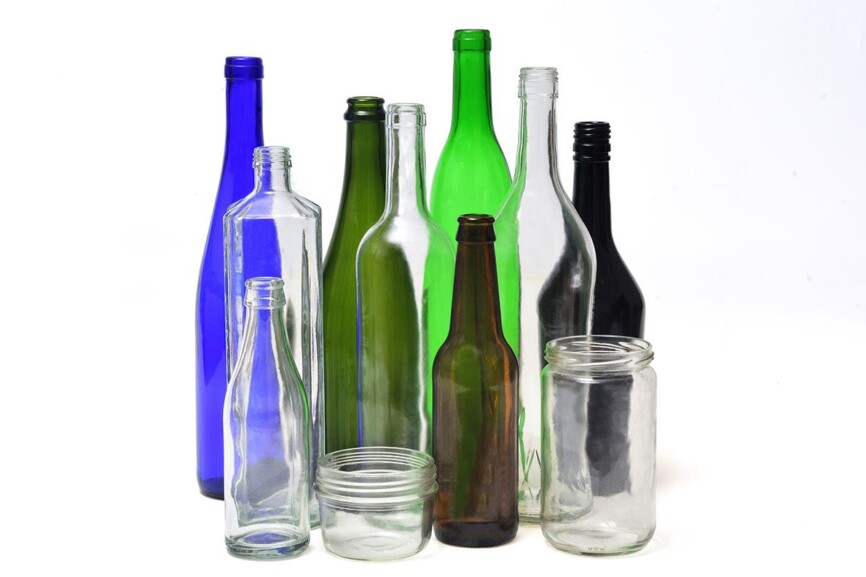
What are the coordinates of `5 tallest bottles` in the screenshot? It's located at [537, 77], [469, 48], [246, 88], [365, 111], [410, 123].